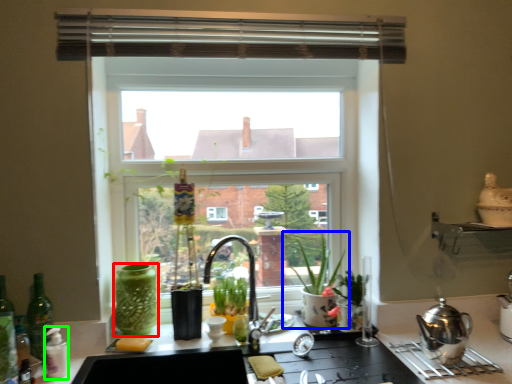
Question: Estimate the real-world distances between objects in this image. Which object is closer to glass vase (highlighted by a red box), houseplant (highlighted by a blue box) or bottle (highlighted by a green box)?

Choices:
 (A) houseplant
 (B) bottle

Answer: (B)